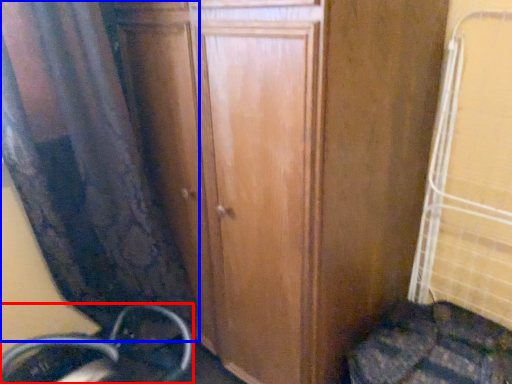
Question: Which object is further to the camera taking this photo, wheel (highlighted by a red box) or curtain (highlighted by a blue box)?

Choices:
 (A) wheel
 (B) curtain

Answer: (A)